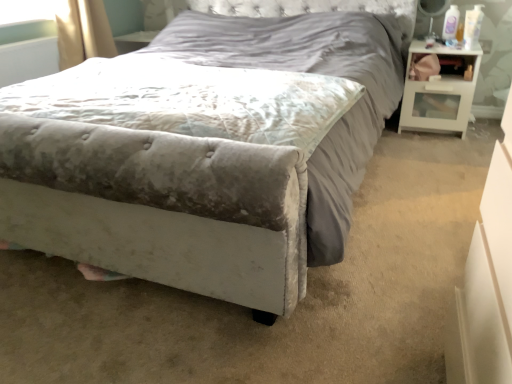
Question: Based on their sizes in the image, would you say velvet gray mattress at center is bigger or smaller than white glossy nightstand at right?

Choices:
 (A) big
 (B) small

Answer: (A)

Question: Which is correct: velvet gray mattress at center is inside white glossy nightstand at right, or outside of it?

Choices:
 (A) inside
 (B) outside

Answer: (B)

Question: Estimate the real-world distances between objects in this image. Which object is farther from the velvet gray mattress at center?

Choices:
 (A) white glossy nightstand at right
 (B) velvet gray bed at center

Answer: (A)

Question: Which is farther from the velvet gray mattress at center?

Choices:
 (A) velvet gray bed at center
 (B) white glossy nightstand at right

Answer: (B)